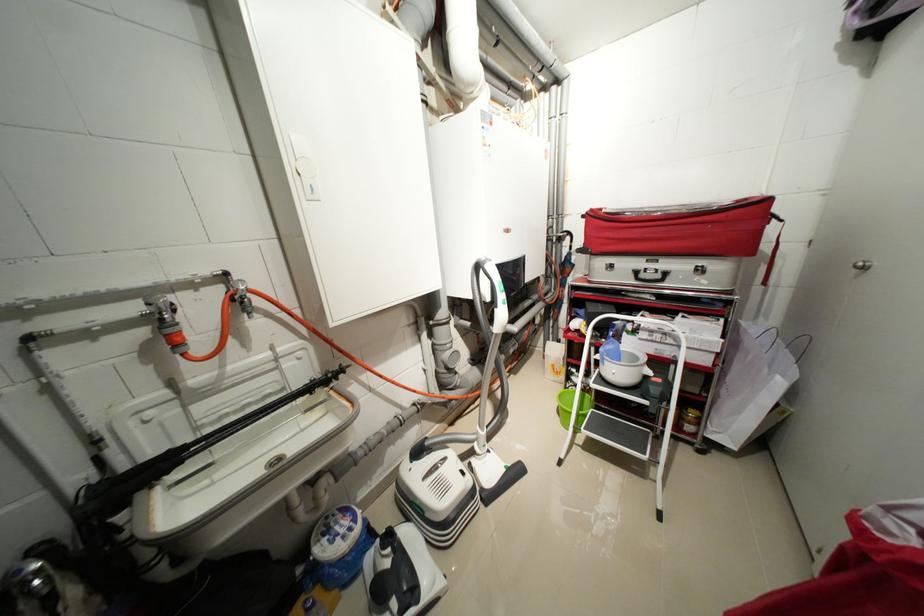
Find the location of `black ladder step`. black ladder step is located at coordinates (624, 432).